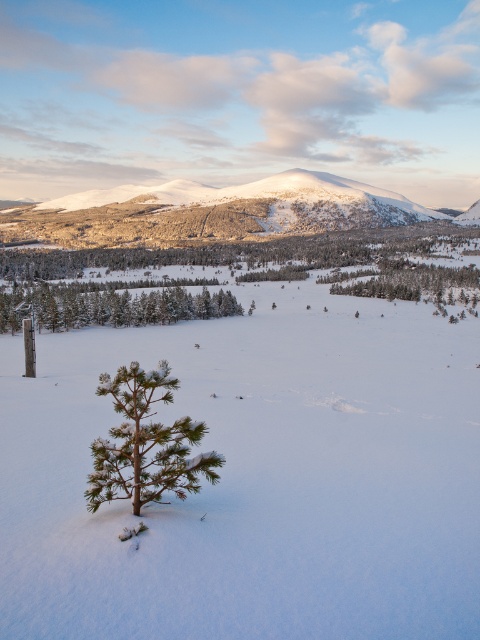
Which is more to the right, green matte pine tree at center or green matte tree at lower left?

Positioned to the right is green matte pine tree at center.

Who is more distant from viewer, (194, 492) or (15, 300)?

Point (15, 300)

You are a GUI agent. You are given a task and a screenshot of the screen. Output one action in this format:
    pyautogui.click(x=<x>, y=<y>)
    Task: Click on the green matte pine tree at center
    Image resolution: width=480 pixels, height=640 pixels.
    Given the screenshot: What is the action you would take?
    pyautogui.click(x=145, y=444)

You are a GUI agent. You are given a task and a screenshot of the screen. Output one action in this format:
    pyautogui.click(x=<x>, y=<y>)
    Task: Click on the green matte pine tree at center
    
    Given the screenshot: What is the action you would take?
    pyautogui.click(x=145, y=444)